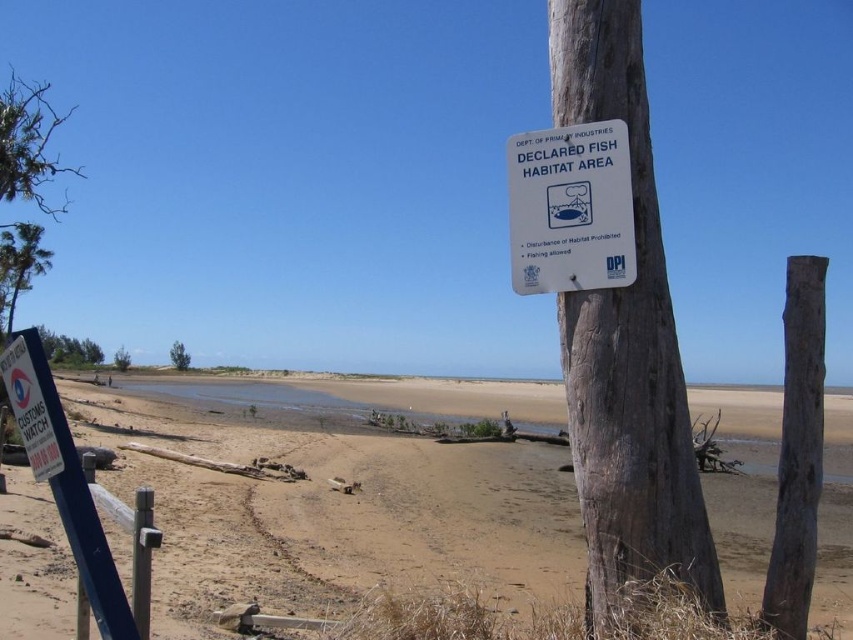
Based on the photo, you are standing at the edge of the sandy brown beach at lower center and want to walk towards the brown rough wood post at right. Which direction should you move to get closer to the post?

The brown rough wood post at right is further away from you than the sandy brown beach at lower center. To move closer to the post, you should walk forward towards it since it is behind the beach in your line of sight.

You are a drone operator tasked with capturing aerial footage of the sandy brown beach at lower center and the brown rough wood post at right. Your drone has a maximum flight range of 10 meters. Can you fly your drone from the beach to the post and back without exceeding its range?

The distance between the sandy brown beach at lower center and the brown rough wood post at right is 10.02 meters. Since the drone can only fly up to 10 meters, the round trip would require 20.04 meters, which exceeds the drone s maximum range. Therefore, the drone cannot safely make the round trip without exceeding its range.